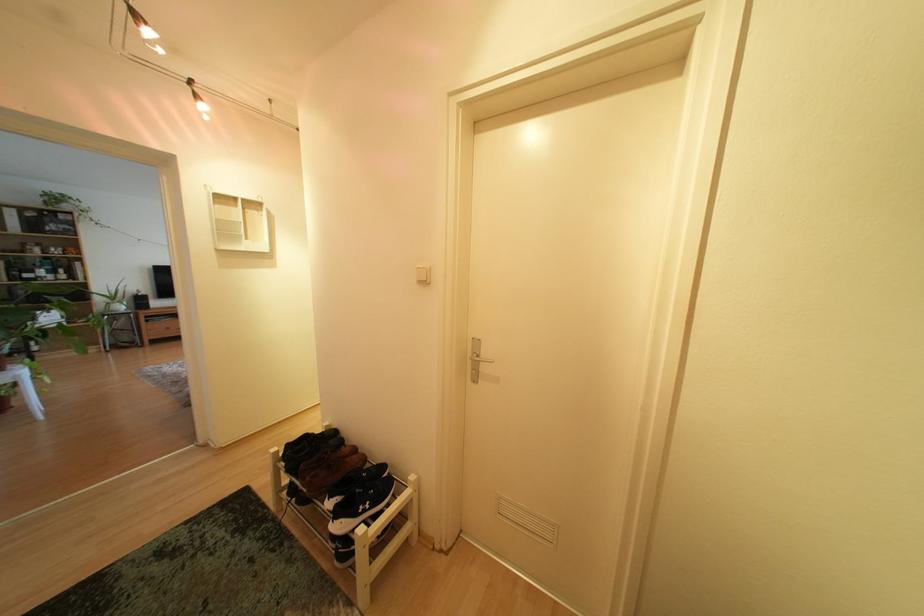
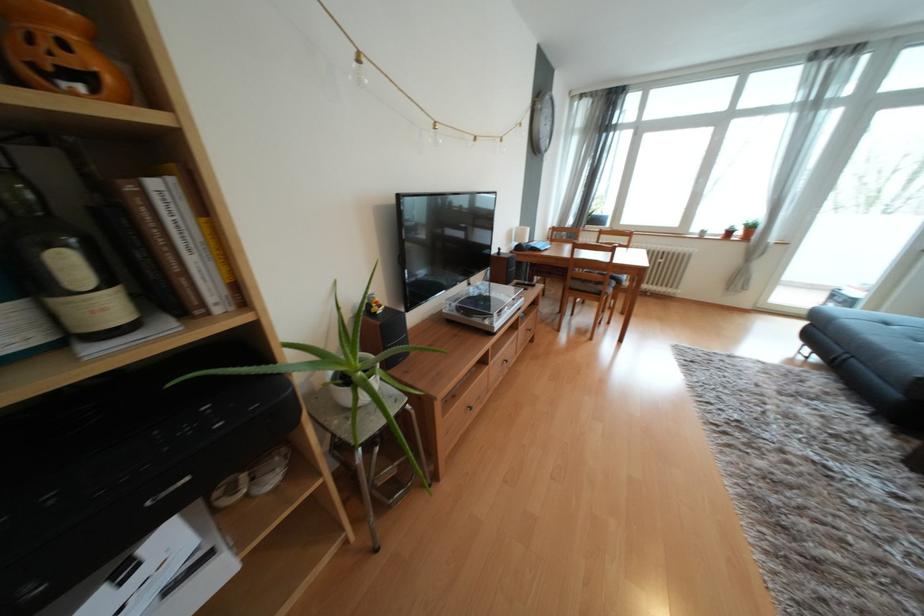
Where in the second image is the point corresponding to point (69, 278) from the first image?

(111, 308)